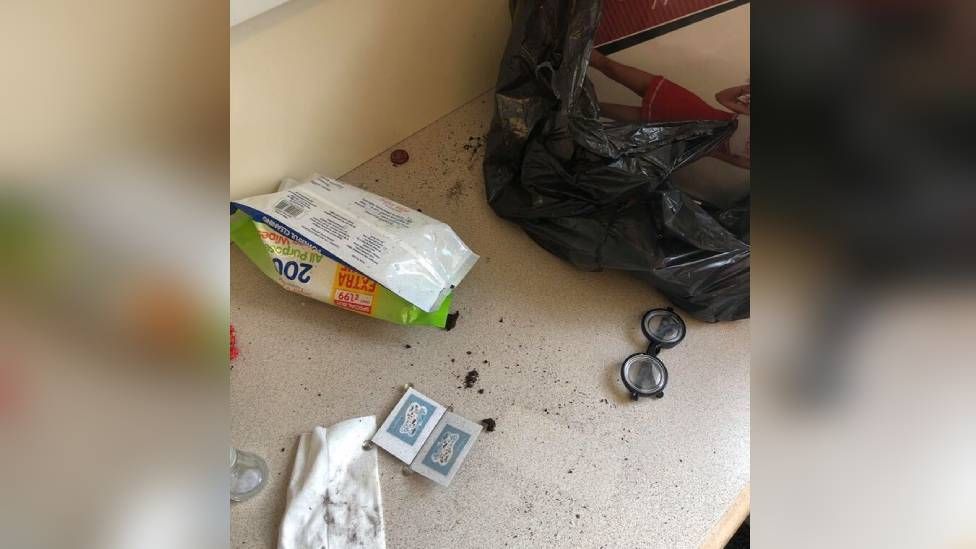
You are a GUI agent. You are given a task and a screenshot of the screen. Output one action in this format:
    pyautogui.click(x=<x>, y=<y>)
    Task: Click on the dusting cloth
    
    Given the screenshot: What is the action you would take?
    pyautogui.click(x=338, y=453)